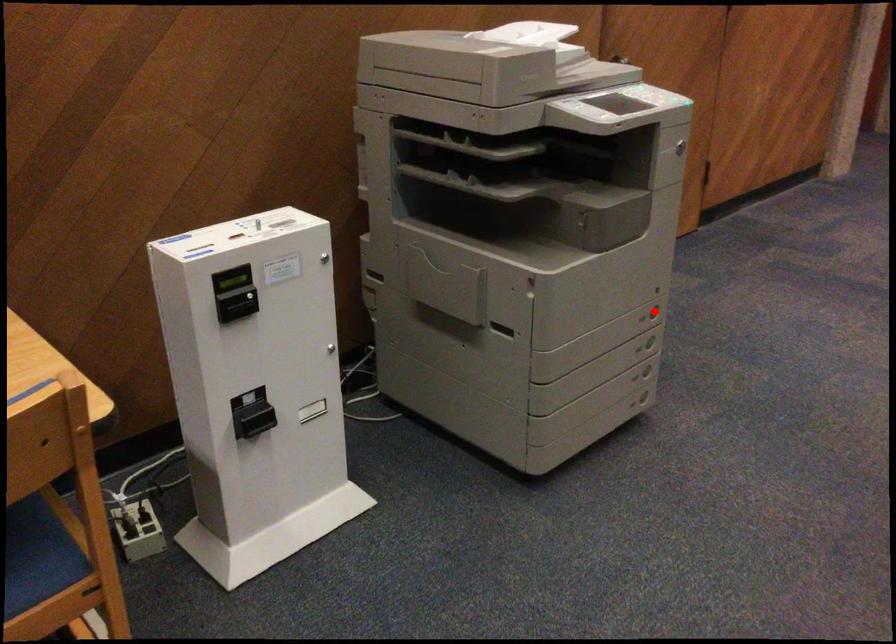
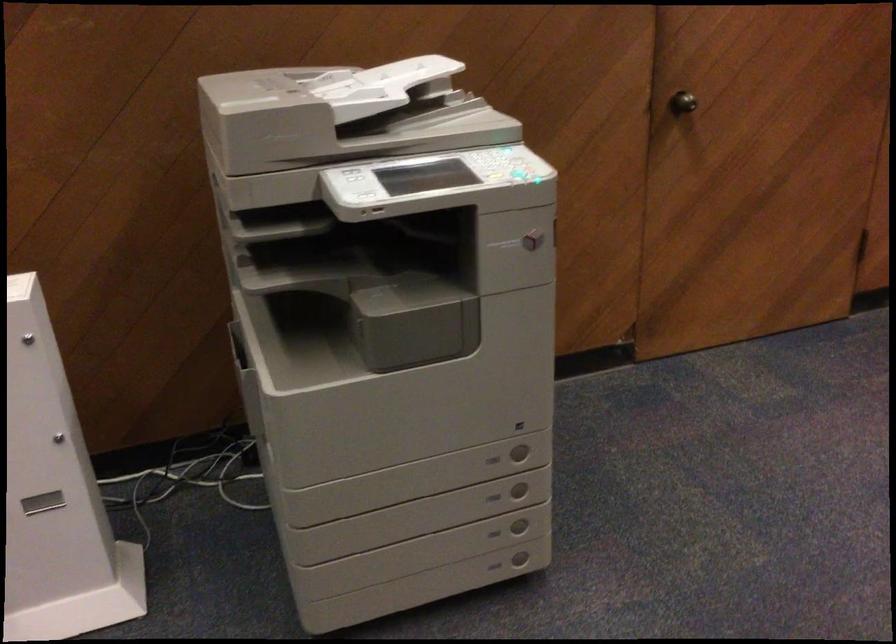
Question: I am providing you with two images of the same scene from different viewpoints. Given a red point in image1, look at the same physical point in image2. Is it:

Choices:
 (A) Closer to the viewpoint
 (B) Farther from the viewpoint

Answer: (A)